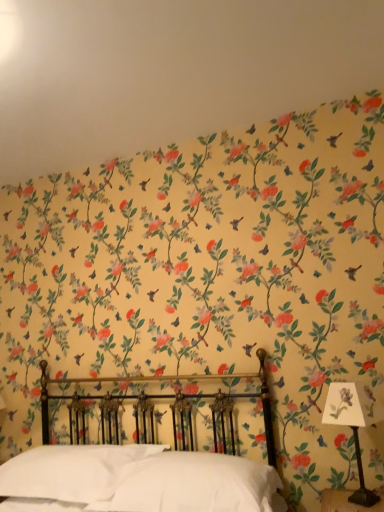
What do you see at coordinates (72, 471) in the screenshot? I see `white soft pillow at lower center, the first pillow from the left` at bounding box center [72, 471].

The width and height of the screenshot is (384, 512). In order to click on white soft pillow at center, the first pillow positioned from the right in this screenshot , I will do `click(195, 484)`.

The image size is (384, 512). Describe the element at coordinates (195, 484) in the screenshot. I see `white soft pillow at center, the first pillow positioned from the right` at that location.

Image resolution: width=384 pixels, height=512 pixels. Describe the element at coordinates (142, 452) in the screenshot. I see `polished brass bed at center` at that location.

Locate an element on the screen. This screenshot has width=384, height=512. white soft pillow at lower center, the first pillow from the left is located at coordinates (72, 471).

What's the angular difference between white soft pillow at lower center, the first pillow from the left, and white paper at right's facing directions?

They differ by 27.1 degrees in their facing directions.

From the image's perspective, between white soft pillow at lower center, the first pillow from the left, and white paper at right, which one is located above?

white paper at right.

Can you confirm if white soft pillow at lower center, which is the second pillow in right-to-left order, is positioned to the right of white paper at right?

In fact, white soft pillow at lower center, which is the second pillow in right-to-left order, is to the left of white paper at right.

Consider the image. Does white soft pillow at lower center, which is the second pillow in right-to-left order, have a larger size compared to white paper at right?

Yes.

Is white paper at right oriented towards white soft pillow at center, which is the second pillow from left to right?

No, white paper at right does not turn towards white soft pillow at center, which is the second pillow from left to right.

Is white paper at right further to camera compared to white soft pillow at center, which is the second pillow from left to right?

Yes, white paper at right is behind white soft pillow at center, which is the second pillow from left to right.

From a real-world perspective, count 1st pillows downward from the white paper at right and point to it. Please provide its 2D coordinates.

[(195, 484)]

Is white paper at right inside or outside of white soft pillow at center, the first pillow positioned from the right?

white paper at right cannot be found inside white soft pillow at center, the first pillow positioned from the right.

Which is farther, (16, 128) or (97, 463)?

The point (16, 128) is farther from the camera.

Would you consider floral wallpaper at upper center to be distant from white soft pillow at lower center, the first pillow from the left?

floral wallpaper at upper center is positioned a significant distance from white soft pillow at lower center, the first pillow from the left.

Does floral wallpaper at upper center have a lesser width compared to white soft pillow at lower center, the first pillow from the left?

No, floral wallpaper at upper center is not thinner than white soft pillow at lower center, the first pillow from the left.

Considering the sizes of objects floral wallpaper at upper center and white soft pillow at lower center, the first pillow from the left, in the image provided, who is shorter, floral wallpaper at upper center or white soft pillow at lower center, the first pillow from the left,?

Standing shorter between the two is floral wallpaper at upper center.

Is the position of white soft pillow at center, which is the second pillow from left to right, less distant than that of white soft pillow at lower center, which is the second pillow in right-to-left order?

Yes, it is in front of white soft pillow at lower center, which is the second pillow in right-to-left order.

From a real-world perspective, which is physically below, white soft pillow at center, the first pillow positioned from the right, or white soft pillow at lower center, which is the second pillow in right-to-left order?

white soft pillow at lower center, which is the second pillow in right-to-left order, from a real-world perspective.

Which is behind, point (194, 453) or point (61, 493)?

The point (194, 453) is more distant.

Does white soft pillow at lower center, the first pillow from the left, appear on the right side of white soft pillow at center, the first pillow positioned from the right?

Incorrect, white soft pillow at lower center, the first pillow from the left, is not on the right side of white soft pillow at center, the first pillow positioned from the right.

Who is shorter, white soft pillow at lower center, the first pillow from the left, or white soft pillow at center, which is the second pillow from left to right?

white soft pillow at center, which is the second pillow from left to right.

Which is closer to the camera, (75, 480) or (127, 505)?

Point (75, 480) appears to be farther away from the viewer than point (127, 505).

Which of these two, white soft pillow at lower center, the first pillow from the left, or white soft pillow at center, the first pillow positioned from the right, is wider?

white soft pillow at center, the first pillow positioned from the right, is wider.

Does polished brass bed at center lie in front of white soft pillow at lower center, which is the second pillow in right-to-left order?

Yes, polished brass bed at center is closer to the camera.

Identify the location of bed that is in front of the white soft pillow at lower center, the first pillow from the left. (142, 452).

Is polished brass bed at center turned away from white soft pillow at lower center, which is the second pillow in right-to-left order?

Yes, white soft pillow at lower center, which is the second pillow in right-to-left order, is at the back of polished brass bed at center.

Considering the sizes of objects polished brass bed at center and white soft pillow at lower center, which is the second pillow in right-to-left order, in the image provided, who is thinner, polished brass bed at center or white soft pillow at lower center, which is the second pillow in right-to-left order,?

white soft pillow at lower center, which is the second pillow in right-to-left order, is thinner.

In the scene shown: Which object is positioned more to the left, polished brass bed at center or floral wallpaper at upper center?

From the viewer's perspective, polished brass bed at center appears more on the left side.

Based on the photo, between polished brass bed at center and floral wallpaper at upper center, which one has smaller width?

Thinner between the two is floral wallpaper at upper center.

Considering the sizes of objects polished brass bed at center and floral wallpaper at upper center in the image provided, who is bigger, polished brass bed at center or floral wallpaper at upper center?

polished brass bed at center is bigger.

Locate an element on the screen. Image resolution: width=384 pixels, height=512 pixels. backdrop on the right of polished brass bed at center is located at coordinates (168, 72).

Image resolution: width=384 pixels, height=512 pixels. I want to click on the 2nd pillow to the left of the white paper at right, counting from the anchor's position, so click(x=72, y=471).

Where is `pillow in front of the white paper at right`? The height and width of the screenshot is (512, 384). pillow in front of the white paper at right is located at coordinates (195, 484).

Which object lies nearer to the anchor point polished brass bed at center, white soft pillow at lower center, which is the second pillow in right-to-left order, or white paper at right?

Based on the image, white soft pillow at lower center, which is the second pillow in right-to-left order, appears to be nearer to polished brass bed at center.

Considering their positions, is polished brass bed at center positioned further to white paper at right than white soft pillow at center, the first pillow positioned from the right?

polished brass bed at center.

Looking at the image, which one is located closer to floral wallpaper at upper center, white paper at right or white soft pillow at lower center, the first pillow from the left?

Among the two, white paper at right is located nearer to floral wallpaper at upper center.

Considering their positions, is white soft pillow at center, which is the second pillow from left to right, positioned further to white soft pillow at lower center, the first pillow from the left, than white paper at right?

The object further to white soft pillow at lower center, the first pillow from the left, is white paper at right.

Which object lies nearer to the anchor point white soft pillow at lower center, which is the second pillow in right-to-left order, white paper at right or white soft pillow at center, the first pillow positioned from the right?

The object closer to white soft pillow at lower center, which is the second pillow in right-to-left order, is white soft pillow at center, the first pillow positioned from the right.

Looking at this image, based on their spatial positions, is white soft pillow at center, the first pillow positioned from the right, or white paper at right closer to polished brass bed at center?

white soft pillow at center, the first pillow positioned from the right.

Considering their positions, is polished brass bed at center positioned further to floral wallpaper at upper center than white soft pillow at lower center, which is the second pillow in right-to-left order?

white soft pillow at lower center, which is the second pillow in right-to-left order, is positioned further to the anchor floral wallpaper at upper center.

Estimate the real-world distances between objects in this image. Which object is further from white soft pillow at lower center, which is the second pillow in right-to-left order, white paper at right or polished brass bed at center?

Among the two, white paper at right is located further to white soft pillow at lower center, which is the second pillow in right-to-left order.

Find the location of a particular element. pillow positioned between polished brass bed at center and white soft pillow at lower center, which is the second pillow in right-to-left order, from near to far is located at coordinates (195, 484).

Locate an element on the screen. This screenshot has height=512, width=384. pillow located between white soft pillow at lower center, the first pillow from the left, and white paper at right in the left-right direction is located at coordinates (195, 484).

Locate an element on the screen. Image resolution: width=384 pixels, height=512 pixels. bedside lamp between floral wallpaper at upper center and polished brass bed at center in the up-down direction is located at coordinates (354, 424).

Find the location of a particular element. This screenshot has height=512, width=384. bed between floral wallpaper at upper center and white soft pillow at center, which is the second pillow from left to right, from top to bottom is located at coordinates (142, 452).